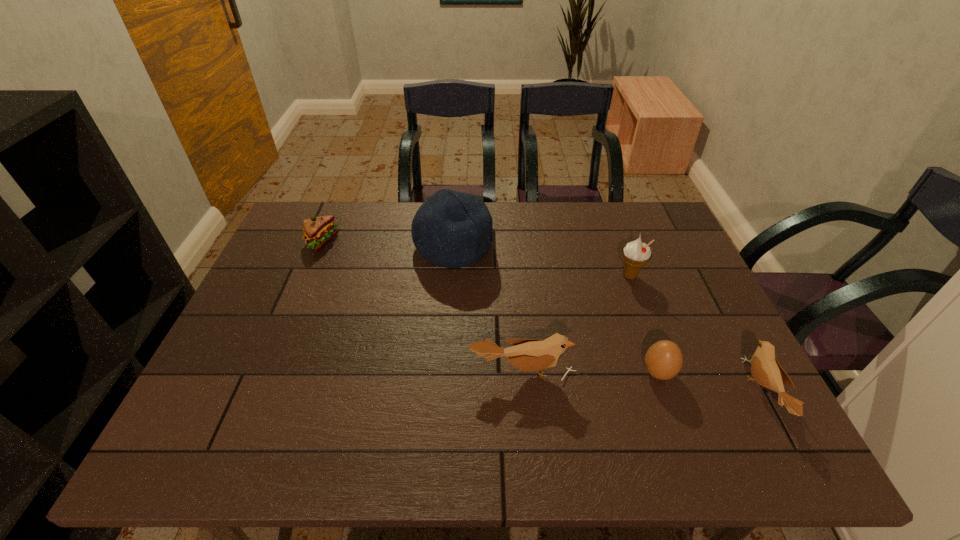
Considering the uniform spacing of birds, where should an additional bird be positioned on the left? Please locate a free spot. Please provide its 2D coordinates. Your answer should be formatted as a tuple, i.e. [(x, y)], where the tuple contains the x and y coordinates of a point satisfying the conditions above.

[(301, 353)]